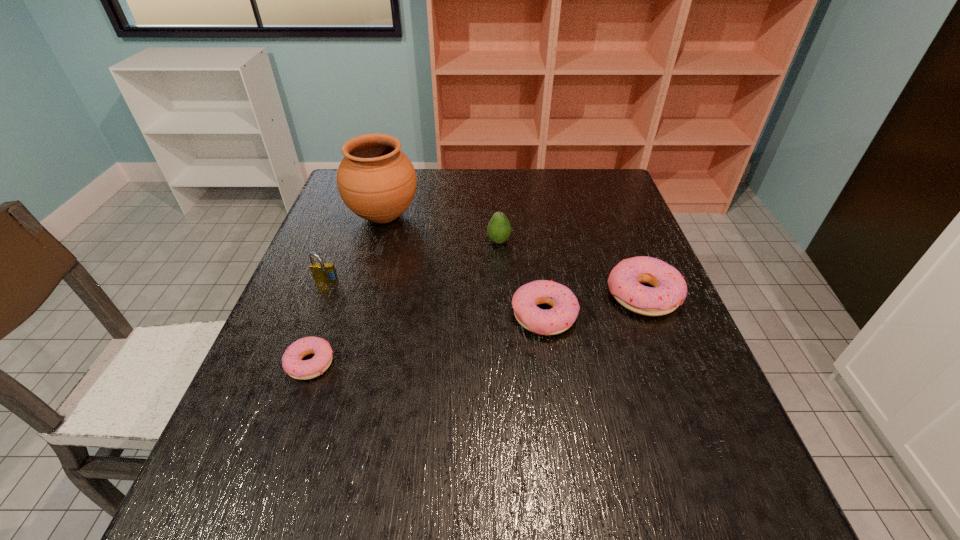
Locate an element on the screen. This screenshot has width=960, height=540. the shortest object is located at coordinates pyautogui.click(x=292, y=363).

You are a GUI agent. You are given a task and a screenshot of the screen. Output one action in this format:
    pyautogui.click(x=<x>, y=<y>)
    Task: Click on the shortest doughnut
    This screenshot has width=960, height=540.
    Given the screenshot: What is the action you would take?
    pyautogui.click(x=292, y=363)

Where is `the fifth tallest object`? the fifth tallest object is located at coordinates (558, 319).

Where is `the second shortest doughnut`? the second shortest doughnut is located at coordinates (558, 319).

This screenshot has width=960, height=540. Identify the location of the rightmost object. (669, 290).

You are a GUI agent. You are given a task and a screenshot of the screen. Output one action in this format:
    pyautogui.click(x=<x>, y=<y>)
    Task: Click on the pottery
    This screenshot has width=960, height=540.
    Given the screenshot: What is the action you would take?
    pyautogui.click(x=376, y=180)

I want to click on padlock, so click(322, 272).

You are a GUI agent. You are given a task and a screenshot of the screen. Output one action in this format:
    pyautogui.click(x=<x>, y=<y>)
    Task: Click on the avocado
    
    Given the screenshot: What is the action you would take?
    pyautogui.click(x=498, y=229)

At what (x,y) coordinates should I click in order to perform the action: click on vacant space situated 0.300m on the right of the shortest doughnut. Please return your answer as a coordinate pair (x, y). The height and width of the screenshot is (540, 960). Looking at the image, I should click on (482, 363).

The height and width of the screenshot is (540, 960). What are the coordinates of `free region located 0.220m on the back of the second tallest doughnut` in the screenshot? It's located at (532, 238).